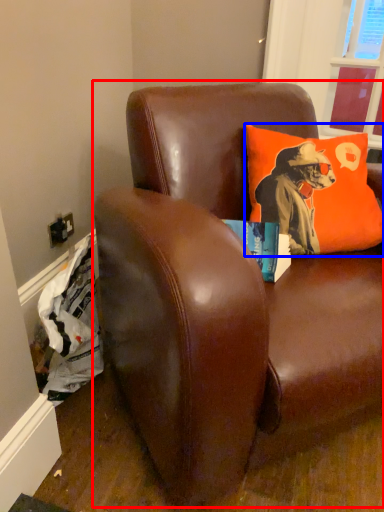
Question: Which object is further to the camera taking this photo, studio couch (highlighted by a red box) or pillow (highlighted by a blue box)?

Choices:
 (A) studio couch
 (B) pillow

Answer: (B)